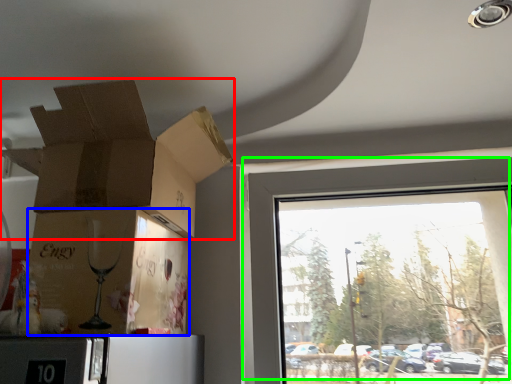
Question: Considering the real-world distances, which object is farthest from cardboard box (highlighted by a red box)? cardboard box (highlighted by a blue box) or window (highlighted by a green box)?

Choices:
 (A) cardboard box
 (B) window

Answer: (B)